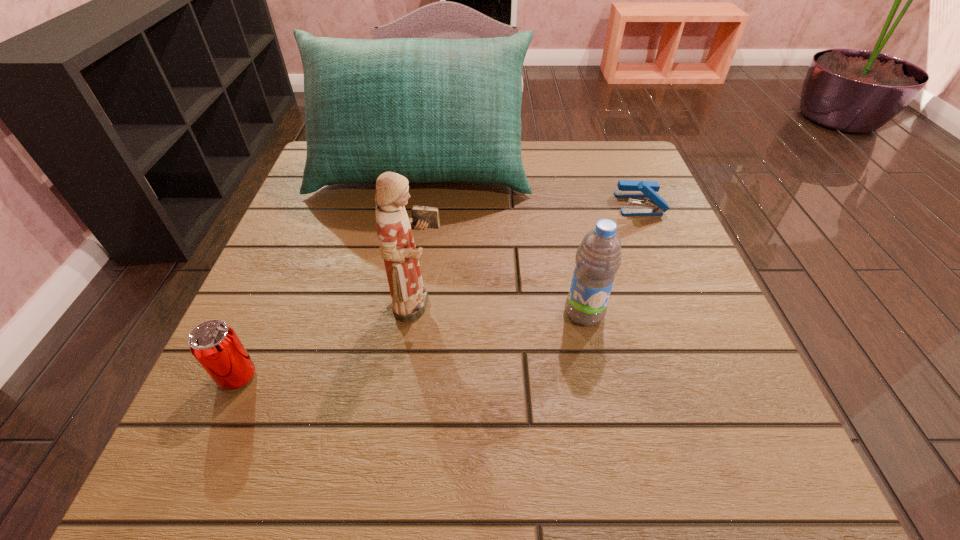
Locate an element on the screen. free space located 0.090m on the back of the water bottle is located at coordinates (573, 262).

Identify the location of vacant space located 0.050m on the back of the second shortest object. The image size is (960, 540). (256, 334).

Locate an element on the screen. This screenshot has height=540, width=960. vacant space located 0.150m on the front of the stapler is located at coordinates (665, 266).

At what (x,y) coordinates should I click in order to perform the action: click on cushion at the far edge. Please return your answer as a coordinate pair (x, y). Looking at the image, I should click on (432, 110).

Find the location of `stapler present at the far edge`. stapler present at the far edge is located at coordinates (627, 188).

Locate an element on the screen. The height and width of the screenshot is (540, 960). cushion present at the left edge is located at coordinates (432, 110).

This screenshot has width=960, height=540. What are the coordinates of `soda can that is at the left edge` in the screenshot? It's located at (215, 345).

Locate an element on the screen. This screenshot has width=960, height=540. object located at the right edge is located at coordinates (627, 188).

The width and height of the screenshot is (960, 540). I want to click on object present at the far left corner, so click(x=432, y=110).

You are a GUI agent. You are given a task and a screenshot of the screen. Output one action in this format:
    pyautogui.click(x=<x>, y=<y>)
    Task: Click on the object that is at the far right corner
    
    Given the screenshot: What is the action you would take?
    pyautogui.click(x=627, y=188)